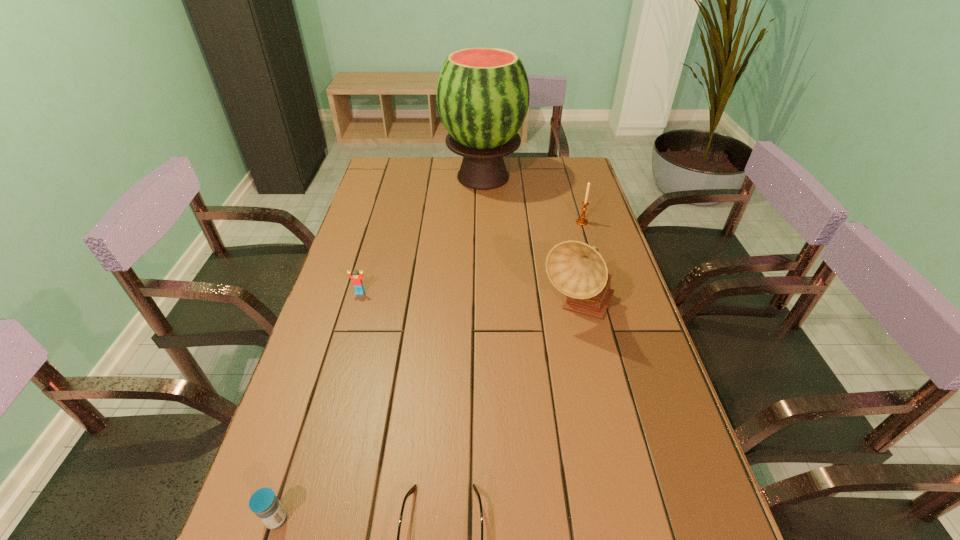
Locate an element on the screen. free point that satisfies the following two spatial constraints: 1. on the back side of the medicine; 2. on the left side of the tallest object is located at coordinates click(385, 177).

Find the location of a particular element. Image resolution: width=960 pixels, height=540 pixels. free location that satisfies the following two spatial constraints: 1. on the front side of the watermelon; 2. on the right side of the candle_holder is located at coordinates (483, 222).

Locate an element on the screen. The width and height of the screenshot is (960, 540). vacant space that satisfies the following two spatial constraints: 1. on the back side of the medicine; 2. on the right side of the fourth shortest object is located at coordinates (371, 222).

What are the coordinates of `vacant area that satisfies the following two spatial constraints: 1. on the back side of the medicine; 2. on the right side of the watermelon` in the screenshot? It's located at (385, 177).